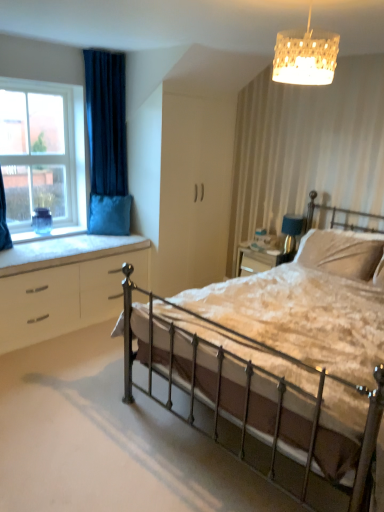
Question: Is clear glass window at left in front of white textured lampshade at upper center?

Choices:
 (A) no
 (B) yes

Answer: (A)

Question: Is white textured lampshade at upper center inside clear glass window at left?

Choices:
 (A) yes
 (B) no

Answer: (B)

Question: Considering the relative sizes of clear glass window at left and white textured lampshade at upper center in the image provided, is clear glass window at left smaller than white textured lampshade at upper center?

Choices:
 (A) yes
 (B) no

Answer: (B)

Question: From the image's perspective, is clear glass window at left located above white textured lampshade at upper center?

Choices:
 (A) yes
 (B) no

Answer: (B)

Question: Is clear glass window at left completely or partially outside of white textured lampshade at upper center?

Choices:
 (A) no
 (B) yes

Answer: (B)

Question: Is point (96, 125) closer or farther from the camera than point (8, 330)?

Choices:
 (A) farther
 (B) closer

Answer: (A)

Question: Looking at the image, does dark blue velvet curtain at upper left seem bigger or smaller compared to white glossy chest of drawers at lower left?

Choices:
 (A) small
 (B) big

Answer: (A)

Question: Would you say dark blue velvet curtain at upper left is to the left or to the right of white glossy chest of drawers at lower left in the picture?

Choices:
 (A) left
 (B) right

Answer: (B)

Question: In terms of height, does dark blue velvet curtain at upper left look taller or shorter compared to white glossy chest of drawers at lower left?

Choices:
 (A) short
 (B) tall

Answer: (B)

Question: Is metallic iron bed at center taller or shorter than clear glass window at left?

Choices:
 (A) tall
 (B) short

Answer: (B)

Question: Is metallic iron bed at center spatially inside clear glass window at left, or outside of it?

Choices:
 (A) inside
 (B) outside

Answer: (B)

Question: Is point (158, 330) closer or farther from the camera than point (9, 202)?

Choices:
 (A) farther
 (B) closer

Answer: (B)

Question: Looking at their shapes, would you say metallic iron bed at center is wider or thinner than clear glass window at left?

Choices:
 (A) wide
 (B) thin

Answer: (A)

Question: Is white textured lampshade at upper center situated inside velvet blue pillow at window, placed as the 2th pillow when sorted from front to back, or outside?

Choices:
 (A) outside
 (B) inside

Answer: (A)

Question: Would you say white textured lampshade at upper center is to the left or to the right of velvet blue pillow at window, which is the 2th pillow in right-to-left order, in the picture?

Choices:
 (A) left
 (B) right

Answer: (B)